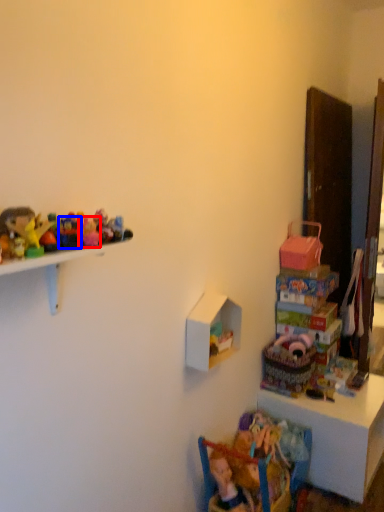
Question: Among these objects, which one is farthest to the camera, toy (highlighted by a red box) or toy (highlighted by a blue box)?

Choices:
 (A) toy
 (B) toy

Answer: (A)